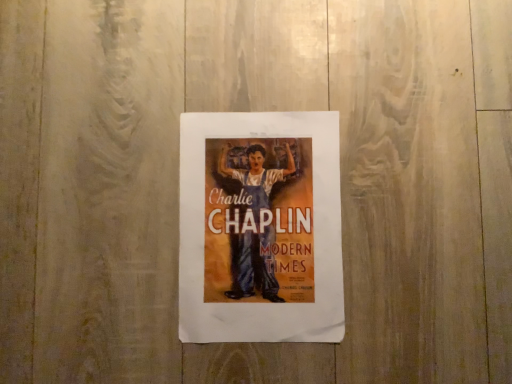
Where is `matte paper poster at center`? matte paper poster at center is located at coordinates (260, 228).

Describe the element at coordinates (260, 228) in the screenshot. The height and width of the screenshot is (384, 512). I see `matte paper poster at center` at that location.

Identify the location of matte paper poster at center. (260, 228).